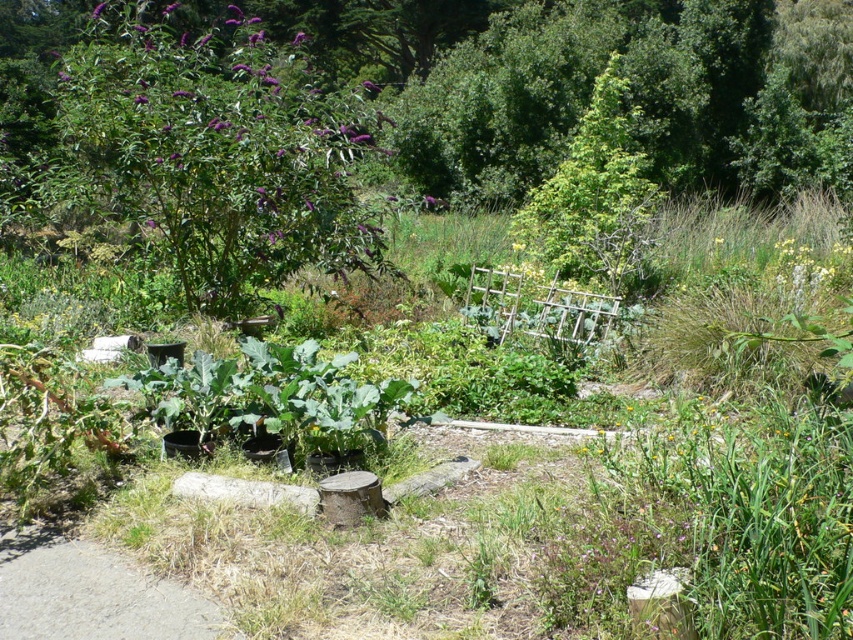
Which is more to the right, purple leafy bush at upper left or gray asphalt path at lower left?

From the viewer's perspective, gray asphalt path at lower left appears more on the right side.

Is point (180, 198) positioned before point (105, 568)?

That is False.

Find the location of a particular element. The image size is (853, 640). purple leafy bush at upper left is located at coordinates (218, 154).

Between point (630, 120) and point (102, 627), which one is positioned behind?

The point (630, 120) is behind.

Which is below, green leafy tree at upper center or gray asphalt path at lower left?

gray asphalt path at lower left is lower down.

The width and height of the screenshot is (853, 640). Describe the element at coordinates (596, 195) in the screenshot. I see `green leafy tree at upper center` at that location.

What are the coordinates of `green leafy tree at upper center` in the screenshot? It's located at (596, 195).

Is purple leafy bush at upper left thinner than green leafy tree at upper center?

Incorrect, purple leafy bush at upper left's width is not less than green leafy tree at upper center's.

Consider the image. Is purple leafy bush at upper left smaller than green leafy tree at upper center?

Actually, purple leafy bush at upper left might be larger than green leafy tree at upper center.

Does point (61, 90) come closer to viewer compared to point (602, 90)?

Yes.

Locate an element on the screen. The height and width of the screenshot is (640, 853). purple leafy bush at upper left is located at coordinates (218, 154).